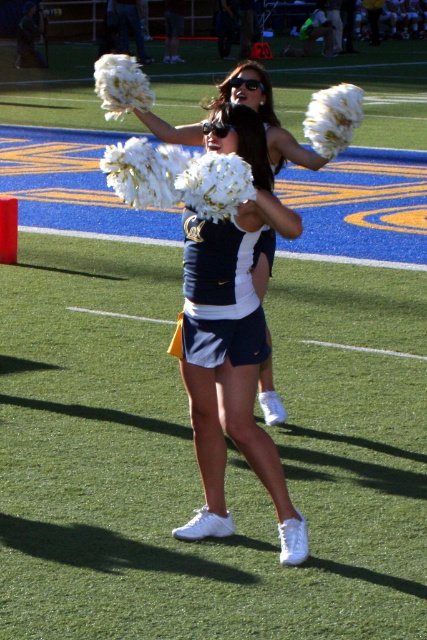
Question: Does navy blue fabric cheerleading uniform at center appear on the left side of white fluffy pom-poms at center?

Choices:
 (A) yes
 (B) no

Answer: (A)

Question: Is navy blue fabric cheerleading uniform at center wider than white fluffy pom-poms at center?

Choices:
 (A) no
 (B) yes

Answer: (A)

Question: Which point is farther to the camera?

Choices:
 (A) white fluffy pom-poms at center
 (B) navy blue fabric cheerleading uniform at center

Answer: (A)

Question: Does navy blue fabric cheerleading uniform at center have a smaller size compared to white fluffy pom-poms at center?

Choices:
 (A) yes
 (B) no

Answer: (B)

Question: Which object appears closest to the camera in this image?

Choices:
 (A) white fluffy pom-poms at center
 (B) navy blue fabric cheerleading uniform at center

Answer: (B)